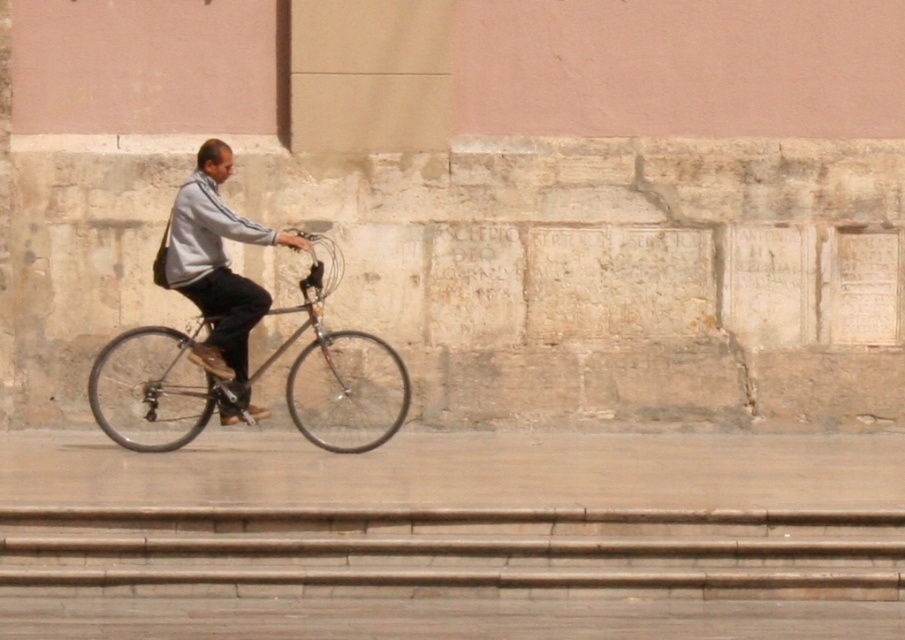
You are standing at the starting point of a 15 meter race. You see the shiny black bicycle at center. Can you reach the bicycle before the race ends?

The distance between you and the shiny black bicycle at center is 13.04 meters, so yes, you can reach it before the race ends since it is within the 15 meter limit.

You are a pedestrian standing on the path and want to pass the man on the shiny black bicycle at center and the light gray fabric jacket at center. Since the path is narrow, which direction should you move to avoid collision?

The shiny black bicycle at center is to the right of the light gray fabric jacket at center, so you should move to the left side to avoid collision.